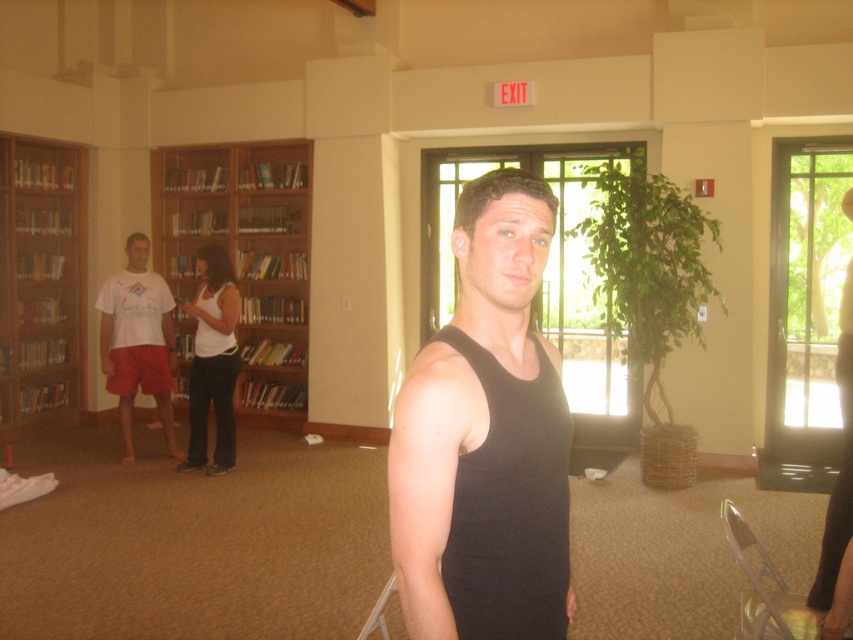
Who is lower down, wooden bookcase at center or white cotton t-shirt at left?

Answer: white cotton t-shirt at left is below.

Is wooden bookcase at center in front of white cotton t-shirt at left?

No, it is behind white cotton t-shirt at left.

Between point (279, 202) and point (122, 364), which one is positioned behind?

Positioned behind is point (279, 202).

Identify the location of wooden bookcase at center. This screenshot has width=853, height=640. (245, 257).

Does wooden bookcase at center have a smaller size compared to wooden bookcase at left?

Actually, wooden bookcase at center might be larger than wooden bookcase at left.

Can you confirm if wooden bookcase at center is shorter than wooden bookcase at left?

Yes.

At what (x,y) coordinates should I click in order to perform the action: click on wooden bookcase at center. Please return your answer as a coordinate pair (x, y). Looking at the image, I should click on (245, 257).

Who is more distant from viewer, (25, 321) or (137, 307)?

Positioned behind is point (25, 321).

Is wooden bookcase at left positioned before white cotton t-shirt at left?

That is False.

Identify the location of wooden bookcase at left. The height and width of the screenshot is (640, 853). (41, 284).